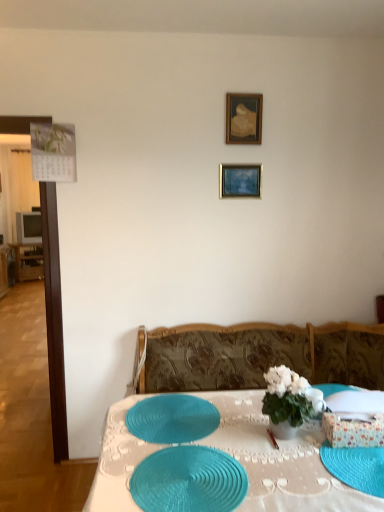
This screenshot has height=512, width=384. Find the location of `free space in front of teal woven placemat at center, the 1th tableware viewed from the back`. free space in front of teal woven placemat at center, the 1th tableware viewed from the back is located at coordinates (180, 475).